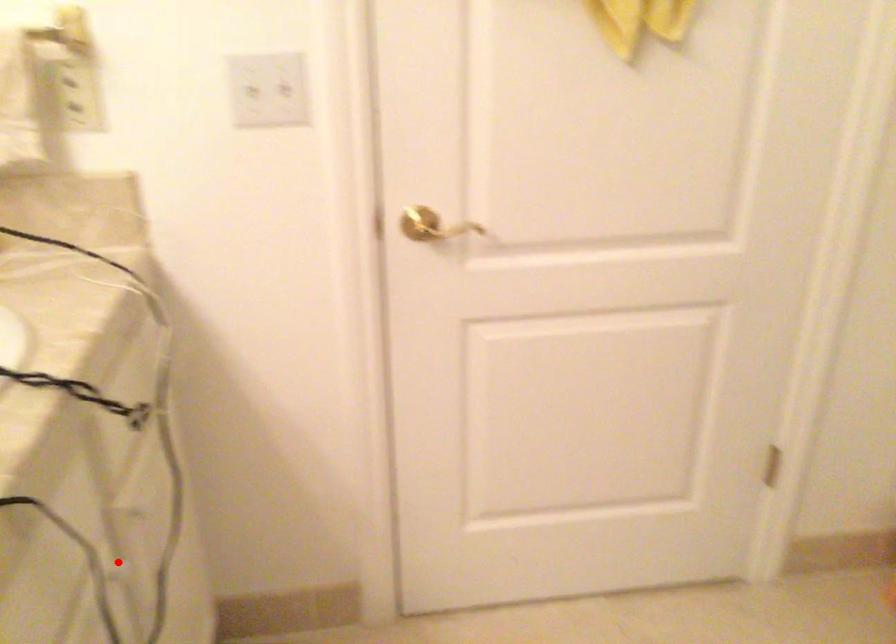
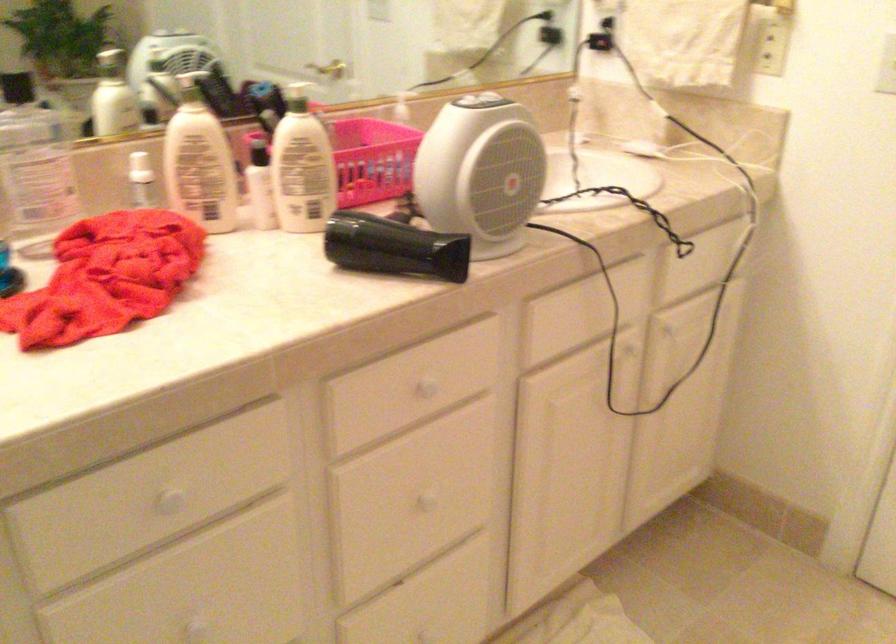
Question: I am providing you with two images of the same scene from different viewpoints. A red point is shown in image1. For the corresponding object point in image2, is it positioned nearer or farther from the camera?

Choices:
 (A) Nearer
 (B) Farther

Answer: (B)